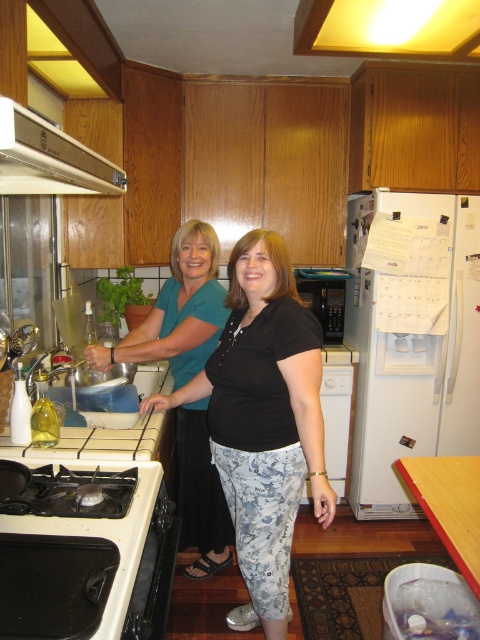
Question: Estimate the real-world distances between objects in this image. Which object is closer to the black cotton shirt at center?

Choices:
 (A) white glossy exhaust hood at upper left
 (B) black matte microwave at center
 (C) white matte refrigerator at right
 (D) black matte stove at lower left

Answer: (D)

Question: Does white matte refrigerator at right appear over white glossy exhaust hood at upper left?

Choices:
 (A) yes
 (B) no

Answer: (B)

Question: Which object appears closest to the camera in this image?

Choices:
 (A) teal fabric shirt at center
 (B) white glossy exhaust hood at upper left
 (C) black matte microwave at center

Answer: (B)

Question: Can you confirm if black cotton shirt at center is positioned above teal fabric shirt at center?

Choices:
 (A) no
 (B) yes

Answer: (A)

Question: Which point is closer to the camera?

Choices:
 (A) (278, 497)
 (B) (72, 188)
 (C) (135, 339)
 (D) (74, 598)

Answer: (D)

Question: From the image, what is the correct spatial relationship of white glossy exhaust hood at upper left in relation to black matte microwave at center?

Choices:
 (A) below
 (B) above

Answer: (B)